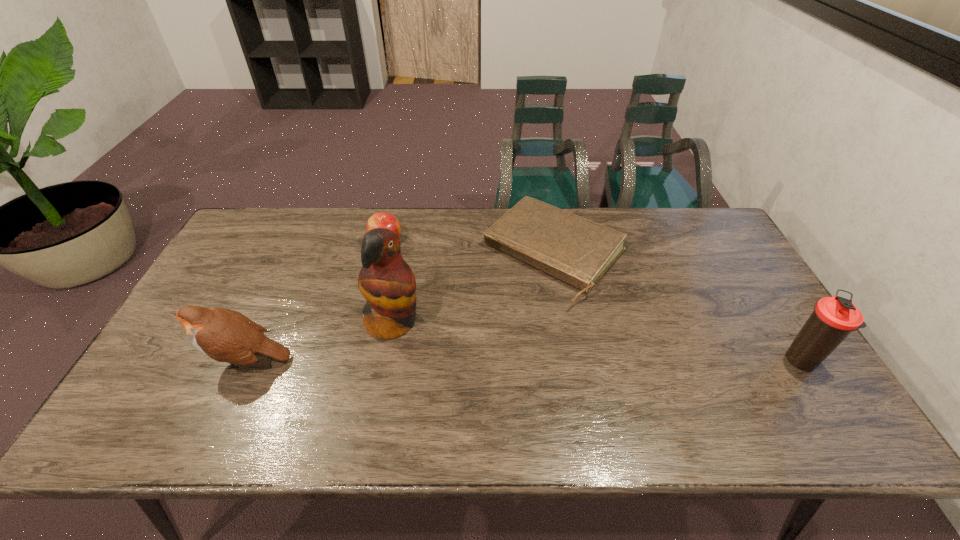
This screenshot has height=540, width=960. Identify the location of vacant space on the desktop that is between the leftmost object and the thermos bottle and is positioned on the face of the parrot. (464, 360).

Locate an element on the screen. This screenshot has height=540, width=960. vacant space on the desktop that is between the bird and the rightmost object and is positioned on the stem of the apple is located at coordinates (443, 360).

Find the location of a particular element. vacant spot on the desktop that is between the leftmost object and the fourth shortest object and is positioned on the spine side of the second object from right to left is located at coordinates (455, 360).